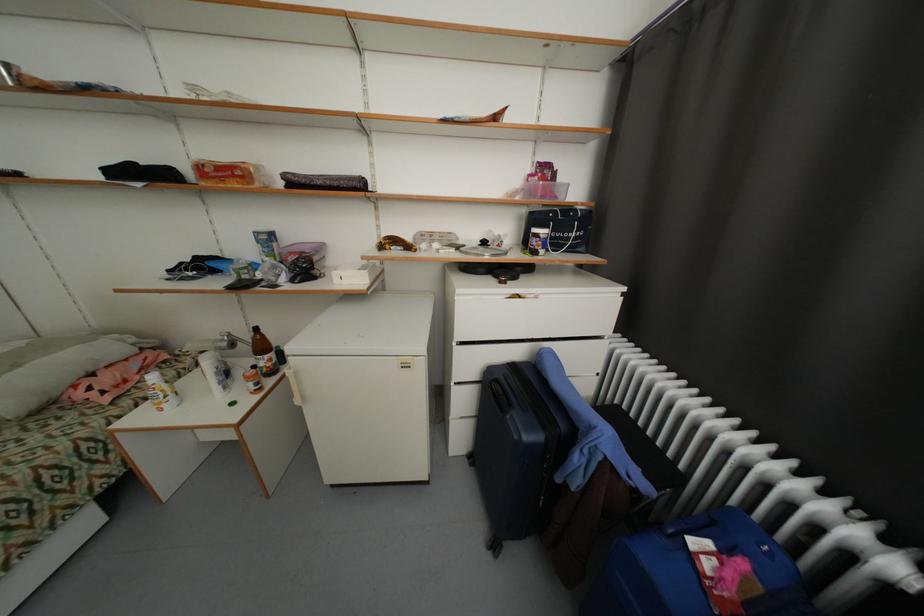
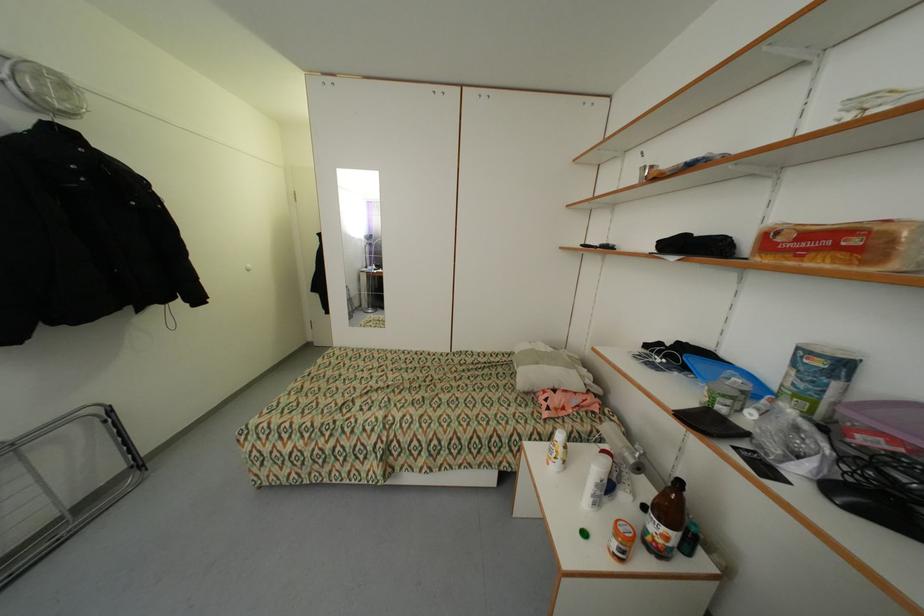
Locate, in the second image, the point that corresponds to [224,376] in the first image.

(603, 487)